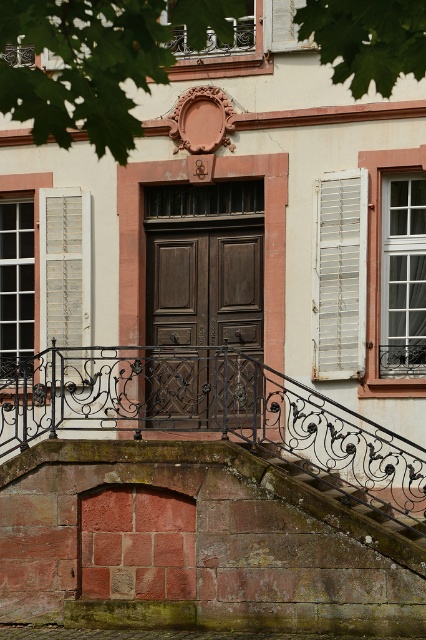
Question: Which of the following is the farthest from the observer?

Choices:
 (A) rusty metal staircase at lower center
 (B) white wood shutter at left
 (C) white painted wood shutter at right

Answer: (B)

Question: Is white painted wood shutter at right to the left of white wood shutter at left from the viewer's perspective?

Choices:
 (A) no
 (B) yes

Answer: (A)

Question: Which point is farther to the camera?

Choices:
 (A) rusty metal staircase at lower center
 (B) dark brown wood door at center
 (C) white painted wood shutter at right

Answer: (C)

Question: Can you confirm if rusty metal balustrade at center is bigger than rusty metal staircase at lower center?

Choices:
 (A) yes
 (B) no

Answer: (A)

Question: Is rusty metal balustrade at center bigger than white wood shutter at left?

Choices:
 (A) yes
 (B) no

Answer: (A)

Question: Which of these objects is positioned farthest from the rusty metal balustrade at center?

Choices:
 (A) white wood shutter at left
 (B) white painted wood shutter at right
 (C) rusty metal staircase at lower center

Answer: (A)